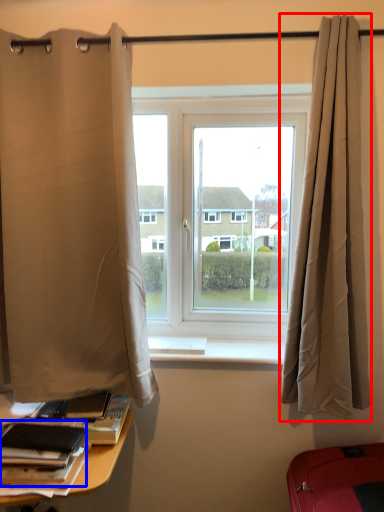
Question: Which of the following is the farthest to the observer, curtain (highlighted by a red box) or book (highlighted by a blue box)?

Choices:
 (A) curtain
 (B) book

Answer: (A)